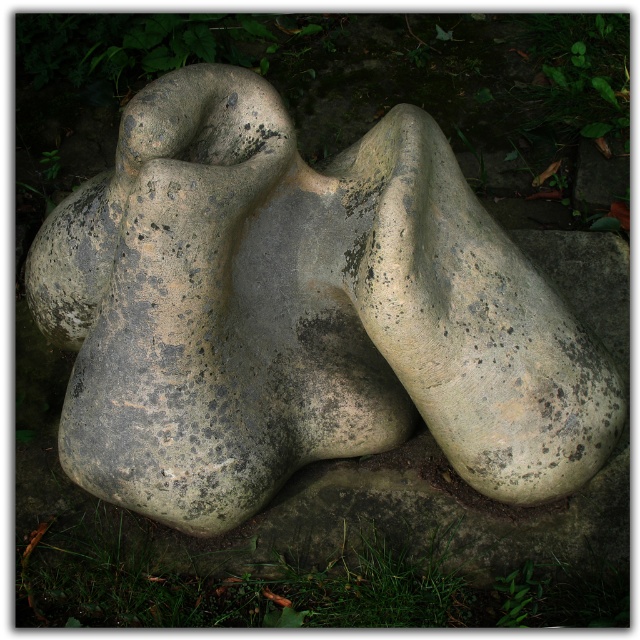
Question: Which object is closer to the camera taking this photo?

Choices:
 (A) green grass at lower center
 (B) gray stone sculpture at center

Answer: (B)

Question: Is gray stone sculpture at center to the left of green grass at lower center from the viewer's perspective?

Choices:
 (A) no
 (B) yes

Answer: (A)

Question: Can you confirm if gray stone sculpture at center is positioned below green grass at lower center?

Choices:
 (A) no
 (B) yes

Answer: (A)

Question: Does gray stone sculpture at center come in front of green grass at lower center?

Choices:
 (A) yes
 (B) no

Answer: (A)

Question: Which point is farther from the camera taking this photo?

Choices:
 (A) (129, 456)
 (B) (403, 564)

Answer: (B)